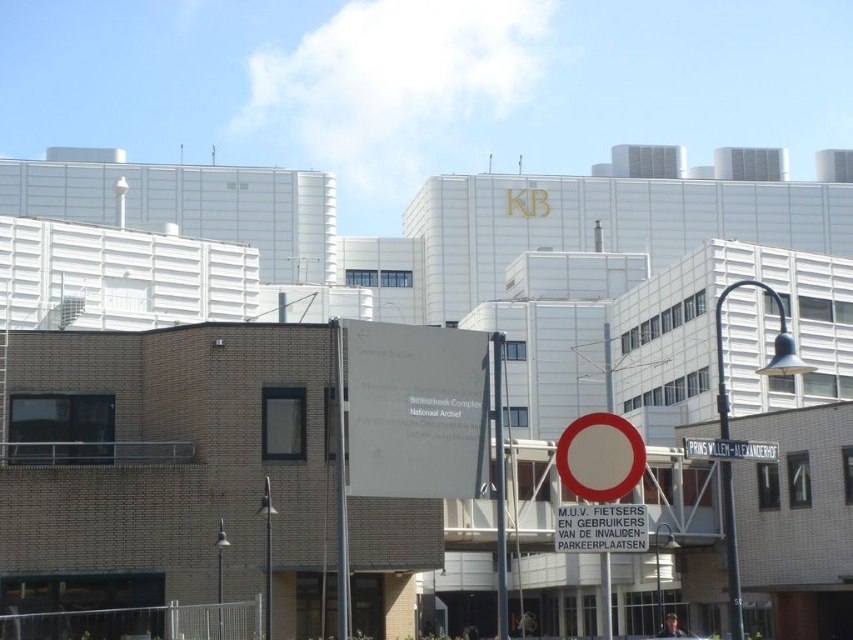
Which is above, metallic pole at center or red circle sign at center?

Positioned higher is red circle sign at center.

Is point (498, 541) farther from viewer compared to point (694, 444)?

Yes, point (498, 541) is farther from viewer.

The image size is (853, 640). What are the coordinates of `metallic pole at center` in the screenshot? It's located at (498, 484).